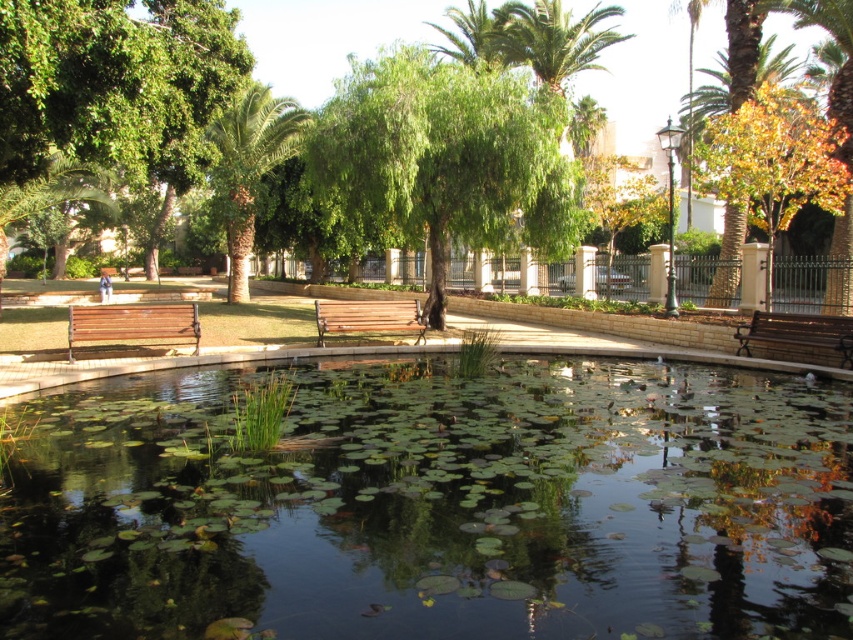
You are a visitor sitting on the wooden bench at center and want to place a small potted plant on the green leafy water at center. Is the water surface high enough to support the pot without it sinking?

The green leafy water at center has a lesser height compared to wooden bench at center, meaning the water surface is lower than the bench. Since the potted plant would need to be placed on the water, the water level might not be high enough to support it properly. Consider placing the plant on the wooden bench at center instead.